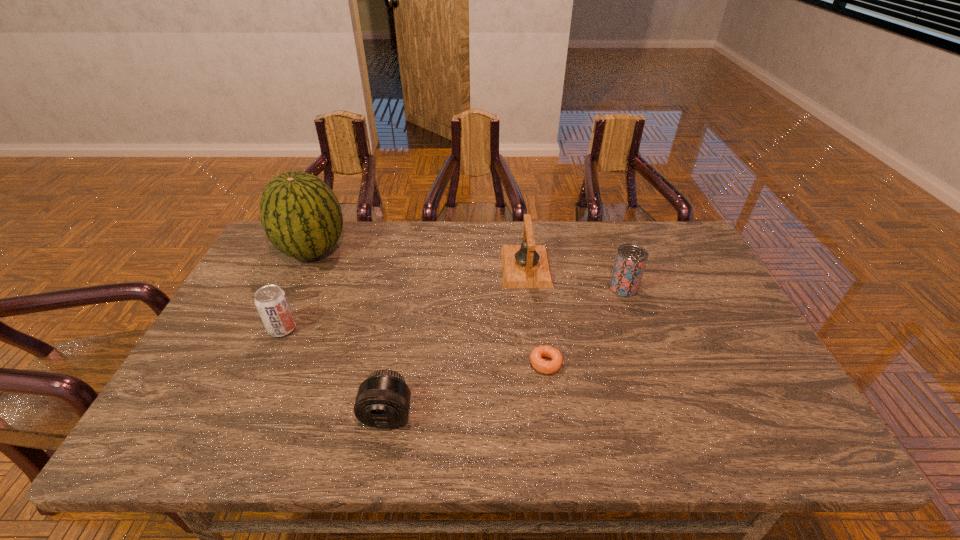
This screenshot has height=540, width=960. I want to click on watermelon, so click(x=301, y=216).

Locate an element on the screen. This screenshot has width=960, height=540. bell is located at coordinates (527, 265).

The width and height of the screenshot is (960, 540). In order to click on the rightmost object in this screenshot , I will do `click(630, 261)`.

Identify the location of the third nearest object. Image resolution: width=960 pixels, height=540 pixels. (271, 301).

At what (x,y) coordinates should I click in order to perform the action: click on telephoto lens. Please return your answer as a coordinate pair (x, y). Looking at the image, I should click on (383, 400).

This screenshot has width=960, height=540. Identify the location of the nearest object. (383, 400).

This screenshot has height=540, width=960. Identify the location of the shortest object. (541, 365).

At what (x,y) coordinates should I click in order to perform the action: click on the second nearest object. Please return your answer as a coordinate pair (x, y). Image resolution: width=960 pixels, height=540 pixels. Looking at the image, I should click on (541, 365).

Locate an element on the screen. This screenshot has height=540, width=960. free space located 0.100m on the front of the watermelon is located at coordinates (292, 296).

Where is `free location located on the left of the bell`? This screenshot has width=960, height=540. free location located on the left of the bell is located at coordinates (384, 267).